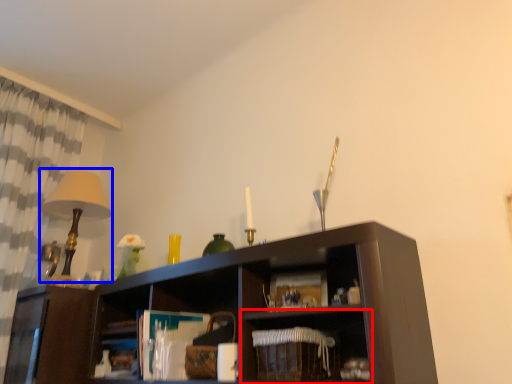
Question: Among these objects, which one is farthest to the camera, shelf (highlighted by a red box) or table lamp (highlighted by a blue box)?

Choices:
 (A) shelf
 (B) table lamp

Answer: (B)